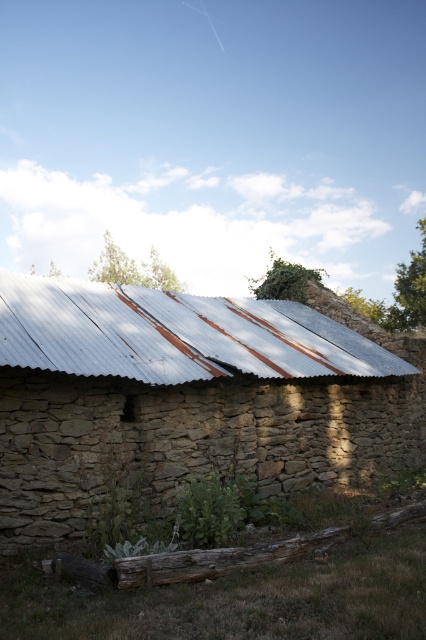
You are standing in front of the rustic stone structure. You see the rusty metal roof at center and the rusty wood log at lower center. Which object is closer to you?

The rusty wood log at lower center is closer to you because the rusty metal roof at center is further away.

You are standing outside the rustic stone structure and want to place a new wooden bench. The bench needs to be placed below the rusty metal barn at center. Is the rusty wood log at lower center an obstacle for placing the bench?

The rusty metal barn at center is located above the rusty wood log at lower center, so the rusty wood log at lower center is already positioned below the barn. Therefore, placing the bench there would mean it would be under the barn, but the log is already occupying that space. You would need to check if there is enough space around the log or choose another location.

You are a painter standing at the entrance of the rusty metal barn at center. You want to paint the rusty metal roof at center. Can you reach it without moving? Please explain your reasoning.

The rusty metal barn at center is 1.15 meters away from the rusty metal roof at center. Since the distance is relatively short, a painter standing at the entrance might be able to reach the roof with an extension pole or ladder, but the exact reach capability depends on the painter and tools available. However, the question specifies not moving, so if the painter cannot extend their reach beyond their current position, they might not be able to reach the roof directly.